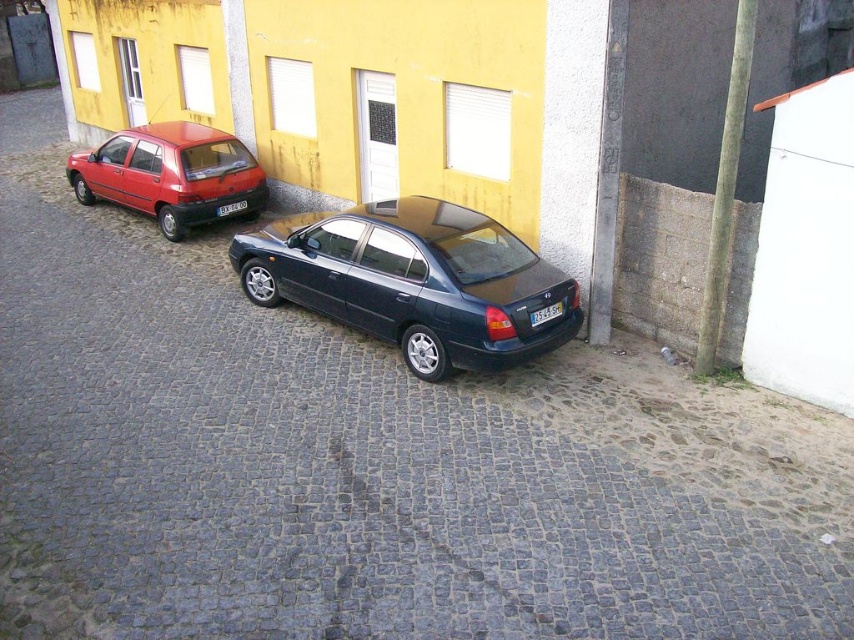
Based on the photo, you are a delivery person trying to determine if a large package can fit between the matte red sedan at left and the black plastic license plate at center. Based on their heights, can the package be placed there without tilting?

The matte red sedan at left is much taller than the black plastic license plate at center, so the package can be placed there without tilting since the height difference allows enough vertical clearance.

You are a delivery driver who needs to park your car between the matte red sedan at left and the black plastic license plate at center. Can your car fit there if your car is 1.8 meters wide?

The matte red sedan at left is wider than the black plastic license plate at center. However, the exact width difference isn t specified, so we can t determine if your car will fit. Please check the actual space.

You are a delivery person trying to read the license plate of the glossy dark blue sedan at center. However, the white plastic license plate at center is obstructed. Can you see the license plate number clearly?

The glossy dark blue sedan at center is positioned over white plastic license plate at center, so the license plate is obstructed and cannot be seen clearly.